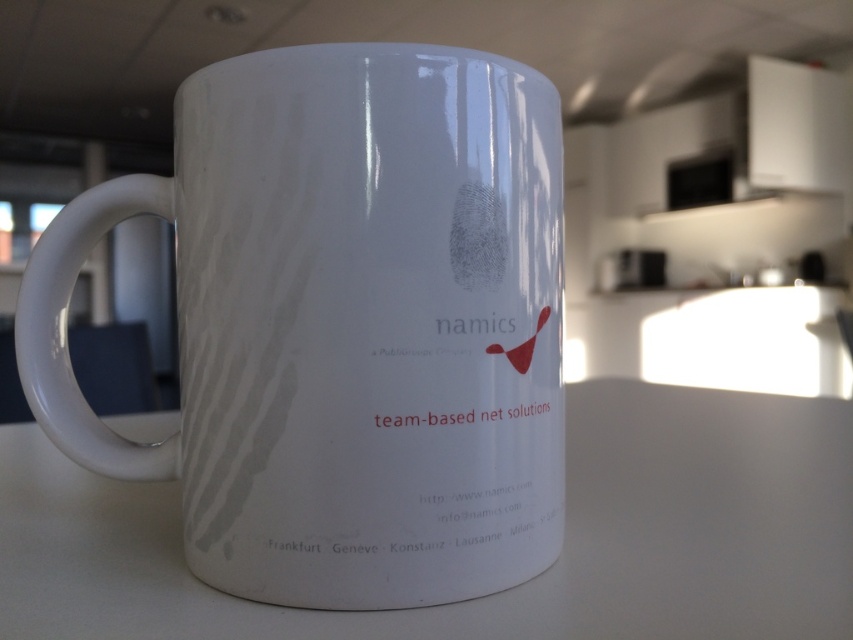
You are holding the white ceramic mug and want to place your finger on the point closer to you between point (444, 483) and point (424, 616). Which point should you choose?

Point (444, 483) is closer to you than point (424, 616), so you should choose point (444, 483).

You are a barista preparing a drink and need to place the glossy ceramic mug at center on the white matte counter top at center. Considering their sizes, will the mug fit on the counter top without hanging over the edges?

The glossy ceramic mug at center has a greater height compared to white matte counter top at center, but height does not determine if it will fit. The width of the mug is not specified, so it is uncertain whether it will fit on the counter top without hanging over the edges.